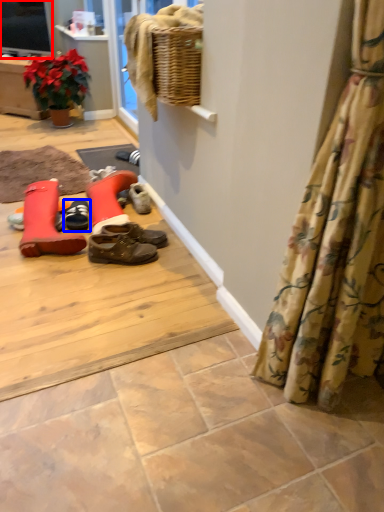
Question: Among these objects, which one is farthest to the camera, television (highlighted by a red box) or footwear (highlighted by a blue box)?

Choices:
 (A) television
 (B) footwear

Answer: (A)